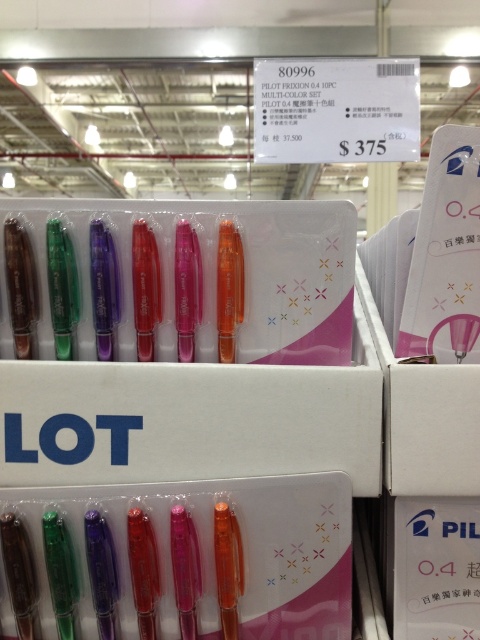
Who is shorter, translucent plastic pens at center or translucent plastic pens at lower center?

With less height is translucent plastic pens at lower center.

Can you confirm if translucent plastic pens at center is positioned above translucent plastic pens at lower center?

Indeed, translucent plastic pens at center is positioned over translucent plastic pens at lower center.

Who is more distant from viewer, (x=312, y=385) or (x=141, y=564)?

The point (x=141, y=564) is behind.

In order to click on translucent plastic pens at center in this screenshot , I will do `click(182, 342)`.